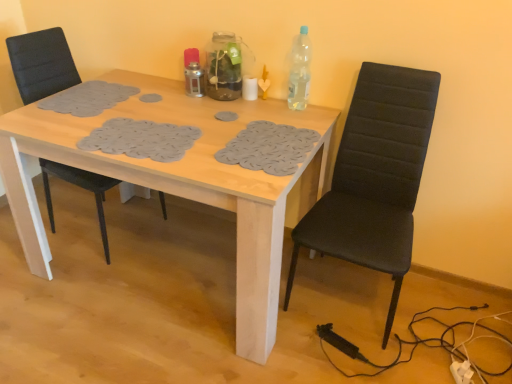
Find the location of a particular element. The height and width of the screenshot is (384, 512). free point below black fabric chair at right, the 2th chair viewed from the left (from a real-world perspective) is located at coordinates (346, 296).